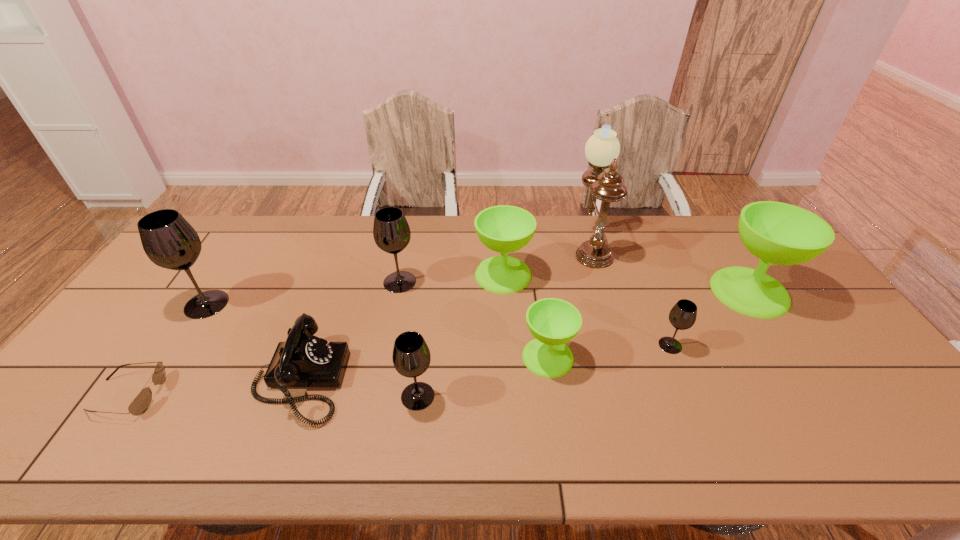
This screenshot has width=960, height=540. In order to click on the closest green wineglass to the eighth object from left to right in this screenshot , I will do `click(504, 229)`.

At what (x,y) coordinates should I click in order to perform the action: click on green wineglass object that ranks as the third closest to the third gray wineglass from left to right. Please return your answer as a coordinate pair (x, y). This screenshot has height=540, width=960. Looking at the image, I should click on (778, 233).

Identify the location of vacant area that satisfies the following two spatial constraints: 1. on the front side of the rightmost gray wineglass; 2. on the dial of the telephone. The height and width of the screenshot is (540, 960). (684, 380).

I want to click on free region that satisfies the following two spatial constraints: 1. on the front side of the second smallest green wineglass; 2. on the right side of the sixth wineglass from left to right, so click(507, 345).

Identify the location of free space in the image that satisfies the following two spatial constraints: 1. on the front side of the second smallest green wineglass; 2. on the right side of the nearest green wineglass. The width and height of the screenshot is (960, 540). (508, 357).

This screenshot has width=960, height=540. I want to click on vacant area in the image that satisfies the following two spatial constraints: 1. on the back side of the sixth object from right to left; 2. on the left side of the tallest object, so click(436, 245).

Identify the location of vacant point that satisfies the following two spatial constraints: 1. on the back side of the third gray wineglass from left to right; 2. on the right side of the tallest object. (436, 245).

What are the coordinates of `free space that satisfies the following two spatial constraints: 1. on the front side of the rightmost object; 2. on the left side of the third object from right to left` in the screenshot? It's located at (605, 292).